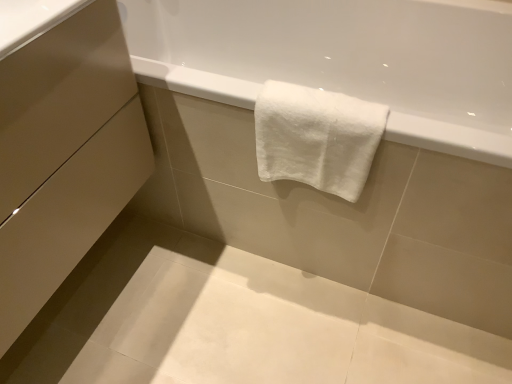
What do you see at coordinates (69, 217) in the screenshot?
I see `matte beige drawer at lower left, marked as the 2th drawer in a top-to-bottom arrangement` at bounding box center [69, 217].

What is the approximate height of matte beige drawer at lower left, which is the 1th drawer from top to bottom?

7.06 inches.

The width and height of the screenshot is (512, 384). What are the coordinates of `matte beige drawer at lower left, marked as the 1th drawer in a bottom-to-top arrangement` in the screenshot? It's located at (69, 217).

Between white cotton towel at upper center and matte beige drawer at lower left, the second drawer positioned from the bottom, which one has larger size?

matte beige drawer at lower left, the second drawer positioned from the bottom.

Does white cotton towel at upper center come behind matte beige drawer at lower left, which is the 1th drawer from top to bottom?

Yes, white cotton towel at upper center is further from the camera.

Is point (268, 169) more distant than point (114, 63)?

That is True.

Is point (115, 77) behind point (287, 118)?

Yes, point (115, 77) is behind point (287, 118).

Does matte beige drawer at lower left, the second drawer positioned from the bottom, touch white cotton towel at upper center?

matte beige drawer at lower left, the second drawer positioned from the bottom, is not next to white cotton towel at upper center, and they're not touching.

From a real-world perspective, relative to white cotton towel at upper center, is matte beige drawer at lower left, the second drawer positioned from the bottom, vertically above or below?

matte beige drawer at lower left, the second drawer positioned from the bottom, is situated higher than white cotton towel at upper center in the real world.

Does matte beige drawer at lower left, the second drawer positioned from the bottom, appear on the left side of white cotton towel at upper center?

Yes, matte beige drawer at lower left, the second drawer positioned from the bottom, is to the left of white cotton towel at upper center.

In the scene shown: From a real-world perspective, is matte beige drawer at lower left, marked as the 2th drawer in a top-to-bottom arrangement, positioned over white cotton towel at upper center based on gravity?

Yes, from a real-world perspective, matte beige drawer at lower left, marked as the 2th drawer in a top-to-bottom arrangement, is on top of white cotton towel at upper center.

Image resolution: width=512 pixels, height=384 pixels. I want to click on the 2nd drawer counting from the left side of the white cotton towel at upper center, so click(x=69, y=217).

Which is more to the left, matte beige drawer at lower left, marked as the 1th drawer in a bottom-to-top arrangement, or white cotton towel at upper center?

matte beige drawer at lower left, marked as the 1th drawer in a bottom-to-top arrangement, is more to the left.

Is point (263, 174) positioned behind point (20, 312)?

Yes, point (263, 174) is behind point (20, 312).

Does white cotton towel at upper center contain matte beige drawer at lower left, marked as the 2th drawer in a top-to-bottom arrangement?

No, matte beige drawer at lower left, marked as the 2th drawer in a top-to-bottom arrangement, is not surrounded by white cotton towel at upper center.

Between white cotton towel at upper center and matte beige drawer at lower left, marked as the 2th drawer in a top-to-bottom arrangement, which one appears on the right side from the viewer's perspective?

white cotton towel at upper center is more to the right.

From a real-world perspective, is white cotton towel at upper center physically above matte beige drawer at lower left, marked as the 2th drawer in a top-to-bottom arrangement?

Actually, white cotton towel at upper center is physically below matte beige drawer at lower left, marked as the 2th drawer in a top-to-bottom arrangement, in the real world.

How many degrees apart are the facing directions of matte beige drawer at lower left, which is the 1th drawer from top to bottom, and matte beige drawer at lower left, marked as the 1th drawer in a bottom-to-top arrangement?

The angle between the facing direction of matte beige drawer at lower left, which is the 1th drawer from top to bottom, and the facing direction of matte beige drawer at lower left, marked as the 1th drawer in a bottom-to-top arrangement, is 0.000128 degrees.

Is point (110, 77) positioned after point (81, 255)?

No, it is in front of (81, 255).

Is matte beige drawer at lower left, marked as the 1th drawer in a bottom-to-top arrangement, surrounded by matte beige drawer at lower left, which is the 1th drawer from top to bottom?

No.

From the image's perspective, is matte beige drawer at lower left, the second drawer positioned from the bottom, below matte beige drawer at lower left, marked as the 2th drawer in a top-to-bottom arrangement?

No, from the image's perspective, matte beige drawer at lower left, the second drawer positioned from the bottom, is not below matte beige drawer at lower left, marked as the 2th drawer in a top-to-bottom arrangement.

From a real-world perspective, which object stands above the other?

From a 3D spatial view, matte beige drawer at lower left, the second drawer positioned from the bottom, is above.

Which is more to the right, matte beige drawer at lower left, marked as the 2th drawer in a top-to-bottom arrangement, or matte beige drawer at lower left, which is the 1th drawer from top to bottom?

Positioned to the right is matte beige drawer at lower left, which is the 1th drawer from top to bottom.

Find the location of a particular element. drawer beneath the matte beige drawer at lower left, which is the 1th drawer from top to bottom (from a real-world perspective) is located at coordinates (69, 217).

Is matte beige drawer at lower left, marked as the 1th drawer in a bottom-to-top arrangement, bigger or smaller than matte beige drawer at lower left, the second drawer positioned from the bottom?

Clearly, matte beige drawer at lower left, marked as the 1th drawer in a bottom-to-top arrangement, is larger in size than matte beige drawer at lower left, the second drawer positioned from the bottom.

The height and width of the screenshot is (384, 512). In order to click on towel that is on the right side of matte beige drawer at lower left, which is the 1th drawer from top to bottom in this screenshot , I will do `click(316, 137)`.

The width and height of the screenshot is (512, 384). In order to click on towel below the matte beige drawer at lower left, which is the 1th drawer from top to bottom (from a real-world perspective) in this screenshot , I will do (x=316, y=137).

Considering their positions, is matte beige drawer at lower left, marked as the 2th drawer in a top-to-bottom arrangement, positioned closer to matte beige drawer at lower left, which is the 1th drawer from top to bottom, than white cotton towel at upper center?

Based on the image, matte beige drawer at lower left, marked as the 2th drawer in a top-to-bottom arrangement, appears to be nearer to matte beige drawer at lower left, which is the 1th drawer from top to bottom.

Looking at this image, from the image, which object appears to be nearer to matte beige drawer at lower left, which is the 1th drawer from top to bottom, white cotton towel at upper center or matte beige drawer at lower left, marked as the 1th drawer in a bottom-to-top arrangement?

matte beige drawer at lower left, marked as the 1th drawer in a bottom-to-top arrangement, lies closer to matte beige drawer at lower left, which is the 1th drawer from top to bottom, than the other object.

Looking at the image, which one is located further to white cotton towel at upper center, matte beige drawer at lower left, marked as the 2th drawer in a top-to-bottom arrangement, or matte beige drawer at lower left, the second drawer positioned from the bottom?

matte beige drawer at lower left, marked as the 2th drawer in a top-to-bottom arrangement, is further to white cotton towel at upper center.

Which object lies nearer to the anchor point matte beige drawer at lower left, marked as the 2th drawer in a top-to-bottom arrangement, white cotton towel at upper center or matte beige drawer at lower left, the second drawer positioned from the bottom?

matte beige drawer at lower left, the second drawer positioned from the bottom, lies closer to matte beige drawer at lower left, marked as the 2th drawer in a top-to-bottom arrangement, than the other object.

Based on the photo, from the image, which object appears to be nearer to white cotton towel at upper center, matte beige drawer at lower left, the second drawer positioned from the bottom, or matte beige drawer at lower left, marked as the 1th drawer in a bottom-to-top arrangement?

The object closer to white cotton towel at upper center is matte beige drawer at lower left, the second drawer positioned from the bottom.

From the image, which object appears to be nearer to matte beige drawer at lower left, marked as the 2th drawer in a top-to-bottom arrangement, matte beige drawer at lower left, which is the 1th drawer from top to bottom, or white cotton towel at upper center?

Among the two, matte beige drawer at lower left, which is the 1th drawer from top to bottom, is located nearer to matte beige drawer at lower left, marked as the 2th drawer in a top-to-bottom arrangement.

This screenshot has width=512, height=384. What are the coordinates of `drawer situated between matte beige drawer at lower left, marked as the 2th drawer in a top-to-bottom arrangement, and white cotton towel at upper center from left to right` in the screenshot? It's located at [59, 97].